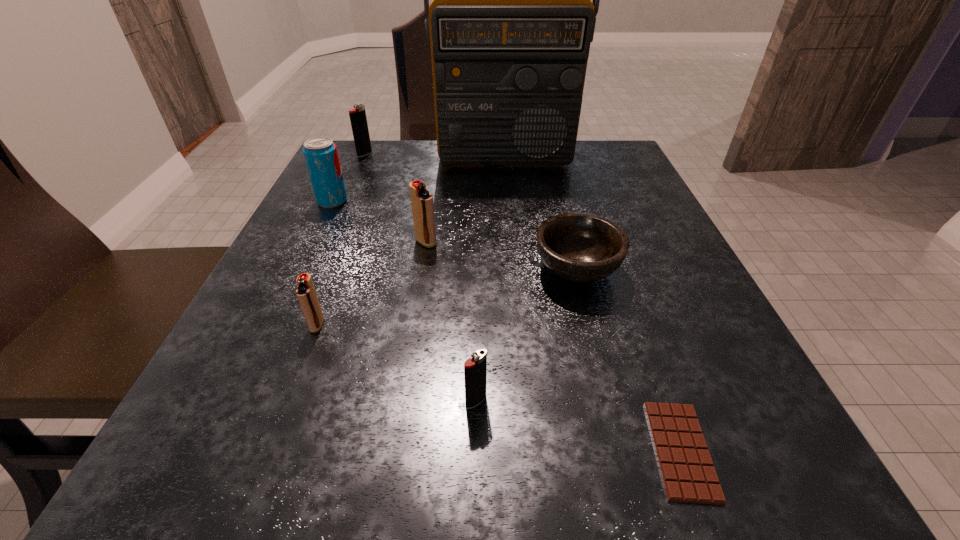
Identify which igniter is located as the second nearest to the farther red igniter. Please provide its 2D coordinates. Your answer should be formatted as a tuple, i.e. [(x, y)], where the tuple contains the x and y coordinates of a point satisfying the conditions above.

[(475, 369)]

Find the location of a particular element. The image size is (960, 540). igniter that is the second closest one to the left red igniter is located at coordinates (475, 369).

Find the location of `vacant area in the image that satisfies the following two spatial constraints: 1. on the front-facing side of the tallest object; 2. on the left side of the bowl`. vacant area in the image that satisfies the following two spatial constraints: 1. on the front-facing side of the tallest object; 2. on the left side of the bowl is located at coordinates (515, 269).

Locate an element on the screen. free spot that satisfies the following two spatial constraints: 1. on the front side of the shortest object; 2. on the left side of the bowl is located at coordinates (623, 450).